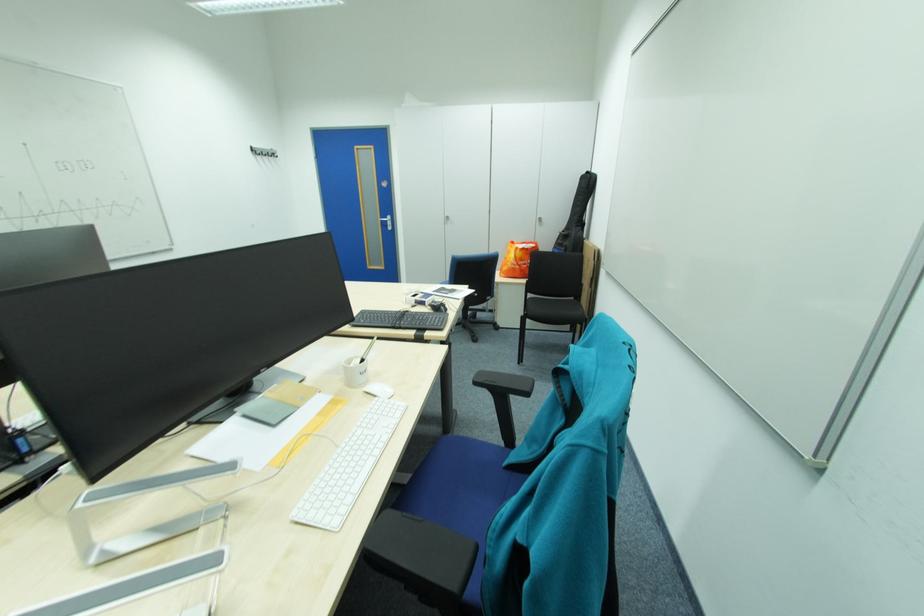
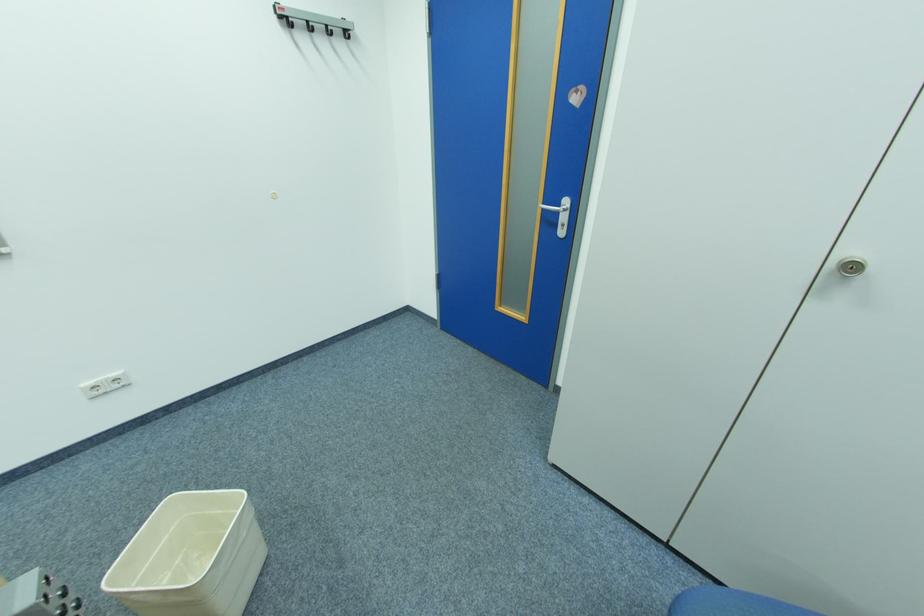
Locate, in the second image, the point that corresponds to (390,221) in the first image.

(552, 209)